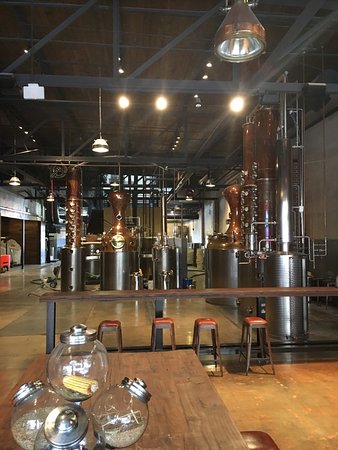
At what (x,y) coordinates should I click in order to perform the action: click on table. Please return your answer as a coordinate pair (x, y). Image resolution: width=338 pixels, height=450 pixels. Looking at the image, I should click on (174, 412).